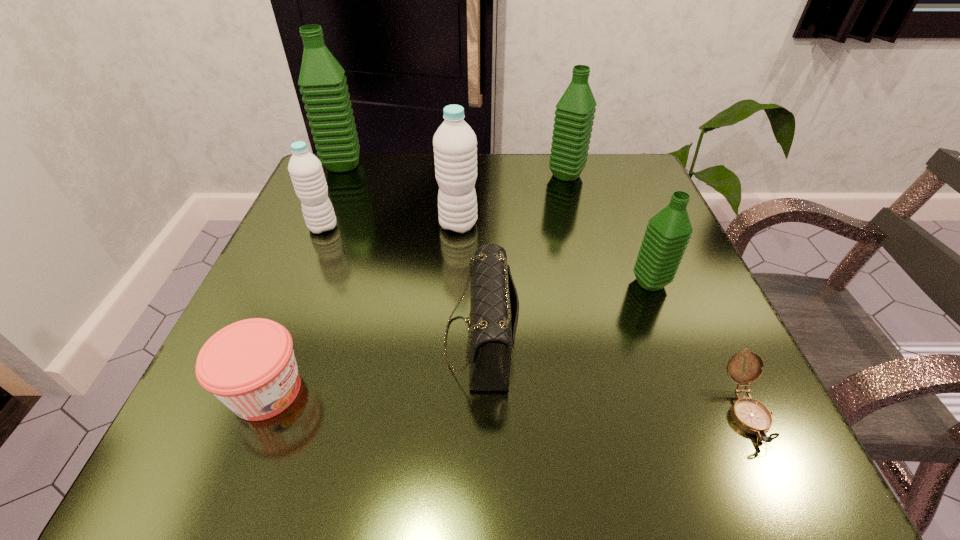
At what (x,y) coordinates should I click in order to perform the action: click on free spot at the far edge of the desktop. Please return your answer as a coordinate pair (x, y). Image resolution: width=960 pixels, height=540 pixels. Looking at the image, I should click on (524, 204).

The image size is (960, 540). I want to click on free spot at the near edge of the desktop, so click(418, 461).

Locate an element on the screen. The width and height of the screenshot is (960, 540). blank space at the left edge of the desktop is located at coordinates (270, 275).

Identify the location of blank space at the right edge. (714, 322).

The height and width of the screenshot is (540, 960). In order to click on free space at the far left corner in this screenshot , I will do `click(369, 186)`.

Locate an element on the screen. The image size is (960, 540). vacant space at the far right corner of the desktop is located at coordinates (644, 205).

This screenshot has height=540, width=960. In order to click on vacant space at the near right corner in this screenshot , I will do `click(743, 465)`.

You are a GUI agent. You are given a task and a screenshot of the screen. Output one action in this format:
    pyautogui.click(x=<x>, y=<y>)
    Task: Click on the free space that is in between the sixth tallest object and the bigger white water bottle
    The image size is (960, 540).
    Given the screenshot: What is the action you would take?
    pyautogui.click(x=469, y=282)

Identify the location of free spot between the compass and the bigger white water bottle. pyautogui.click(x=602, y=318).

The width and height of the screenshot is (960, 540). What are the coordinates of `vacant area that lies between the second green water bottle from right to left and the fourth nearest object` in the screenshot? It's located at click(608, 229).